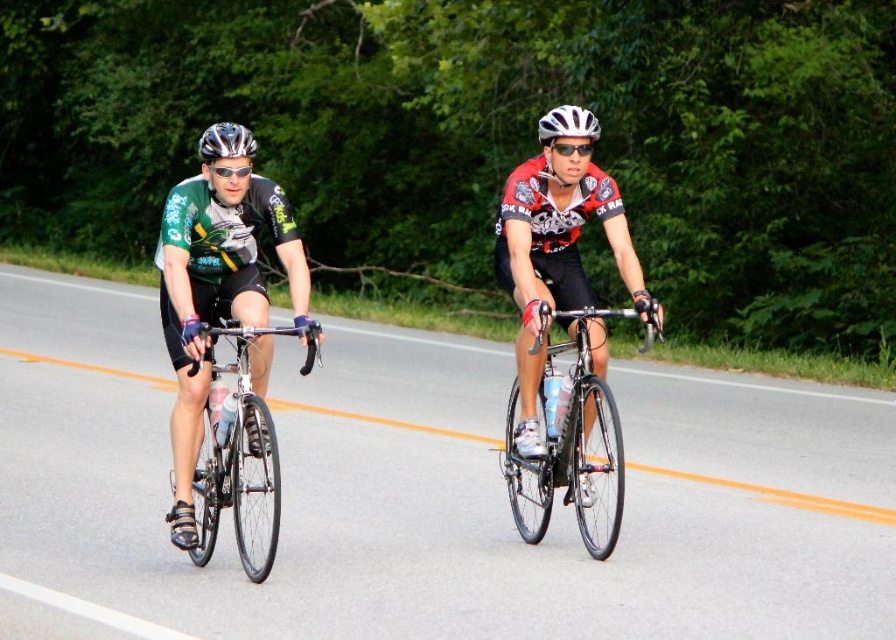
The image size is (896, 640). Identify the location of matte black cycling jersey at left. point(214,292).

Between matte black cycling jersey at left and shiny silver bicycle at left, which one has more height?

With more height is shiny silver bicycle at left.

Is point (231, 186) closer to camera compared to point (190, 369)?

No.

Where is `matte black cycling jersey at left`? The width and height of the screenshot is (896, 640). matte black cycling jersey at left is located at coordinates (214, 292).

Can you confirm if matte black bicycle at center is shorter than matte black cycling jersey at left?

Incorrect, matte black bicycle at center's height does not fall short of matte black cycling jersey at left's.

What are the coordinates of `matte black bicycle at center` in the screenshot? It's located at (214, 305).

Who is more distant from viewer, (567, 208) or (229, 209)?

The point (567, 208) is more distant.

This screenshot has height=640, width=896. I want to click on matte black bicycle at center, so click(214, 305).

Does matte black helmet at left have a lesser width compared to white matte bicycle helmet at center?

No.

Does point (210, 182) come farther from viewer compared to point (540, 129)?

No, it is not.

Where is `matte black helmet at left`? This screenshot has height=640, width=896. matte black helmet at left is located at coordinates (226, 161).